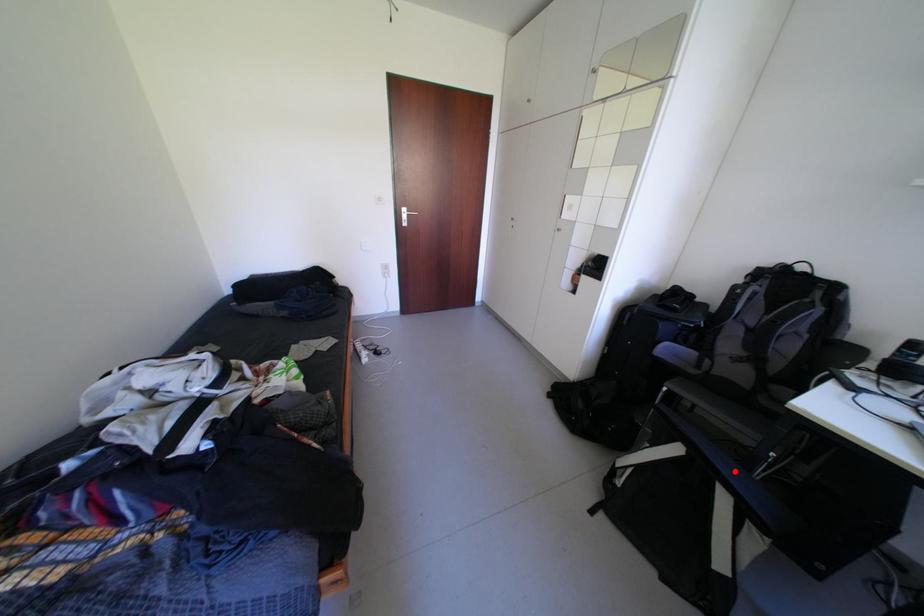
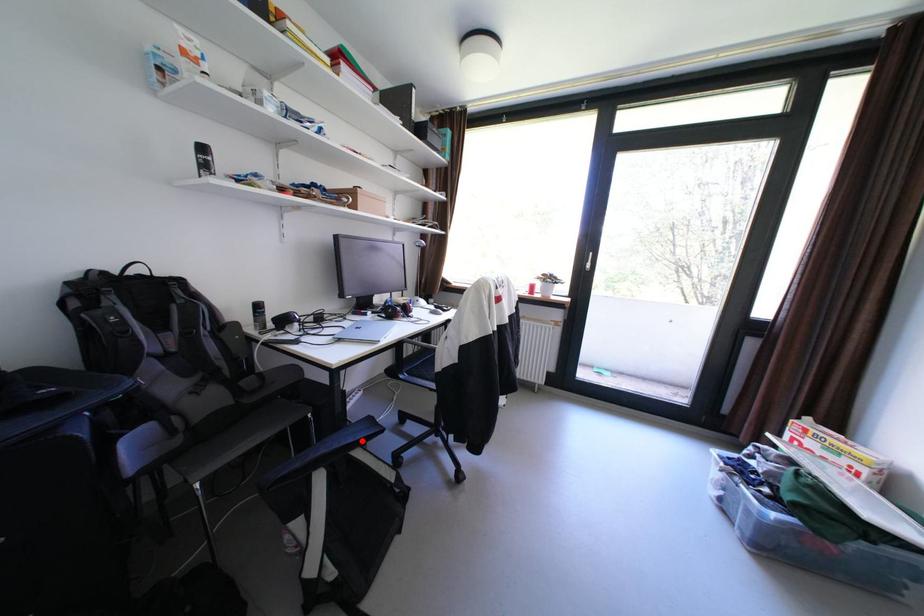
Looking at this image, I am providing you with two images of the same scene from different viewpoints. A red point is marked on the first image and another point is marked on the second image. Are the points marked in image1 and image2 representing the same 3D position?

Yes